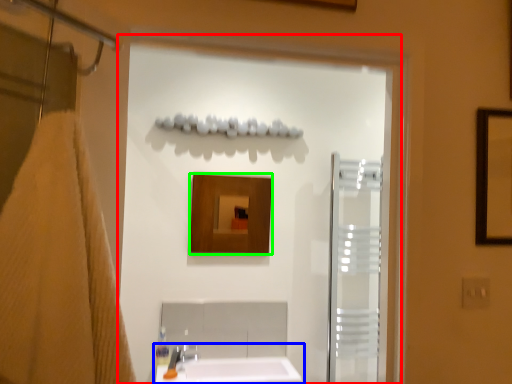
Question: Which is nearer to the screen door (highlighted by a red box)? sink (highlighted by a blue box) or mirror (highlighted by a green box).

Choices:
 (A) sink
 (B) mirror

Answer: (B)